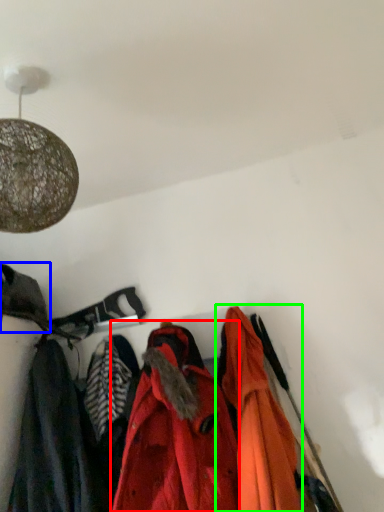
Question: Estimate the real-world distances between objects in this image. Which object is farther from jacket (highlighted by a red box), cloak (highlighted by a blue box) or jacket (highlighted by a green box)?

Choices:
 (A) cloak
 (B) jacket

Answer: (A)